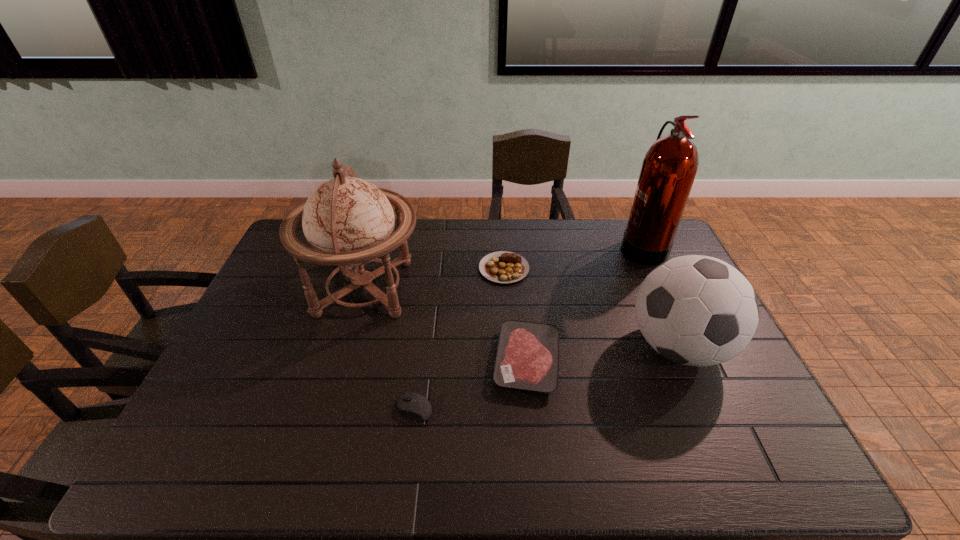
Identify the location of free space between the nearer steak and the computer equipment. The height and width of the screenshot is (540, 960). (470, 385).

Identify the location of free space between the farther steak and the nearer steak. Image resolution: width=960 pixels, height=540 pixels. (516, 315).

The image size is (960, 540). Identify the location of empty location between the globe and the nearer steak. coord(445,325).

You are a GUI agent. You are given a task and a screenshot of the screen. Output one action in this format:
    pyautogui.click(x=<x>, y=<y>)
    Task: Click on the vacant region between the fire extinguisher and the farther steak
    
    Given the screenshot: What is the action you would take?
    (x=573, y=257)

Locate an element on the screen. The width and height of the screenshot is (960, 540). vacant point located between the globe and the farther steak is located at coordinates (434, 279).

The image size is (960, 540). In order to click on object that is the closest to the farther steak in this screenshot , I will do `click(348, 222)`.

Identify which object is located as the fourth nearest to the farther steak. Please provide its 2D coordinates. Your answer should be formatted as a tuple, i.e. [(x, y)], where the tuple contains the x and y coordinates of a point satisfying the conditions above.

[(669, 168)]

The image size is (960, 540). I want to click on vacant region that satisfies the following two spatial constraints: 1. on the front-facing side of the fire extinguisher; 2. on the front side of the farther steak, so click(x=653, y=268).

Where is `vacant position in the image that satisfies the following two spatial constraints: 1. at the front of the globe showing Africa; 2. on the right side of the computer equipment`? The width and height of the screenshot is (960, 540). vacant position in the image that satisfies the following two spatial constraints: 1. at the front of the globe showing Africa; 2. on the right side of the computer equipment is located at coordinates (329, 409).

I want to click on vacant region that satisfies the following two spatial constraints: 1. on the front side of the farther steak; 2. on the left side of the fourth shortest object, so click(x=509, y=347).